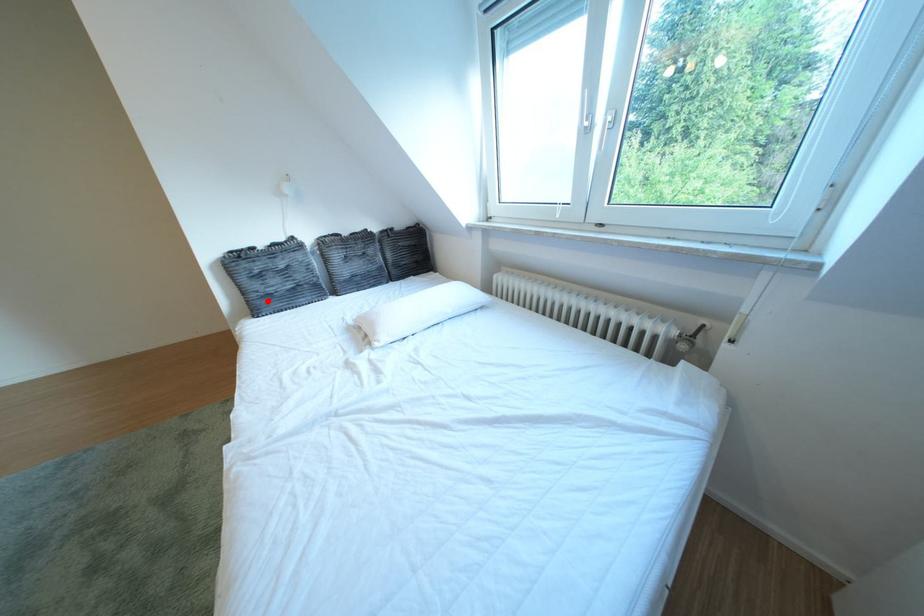
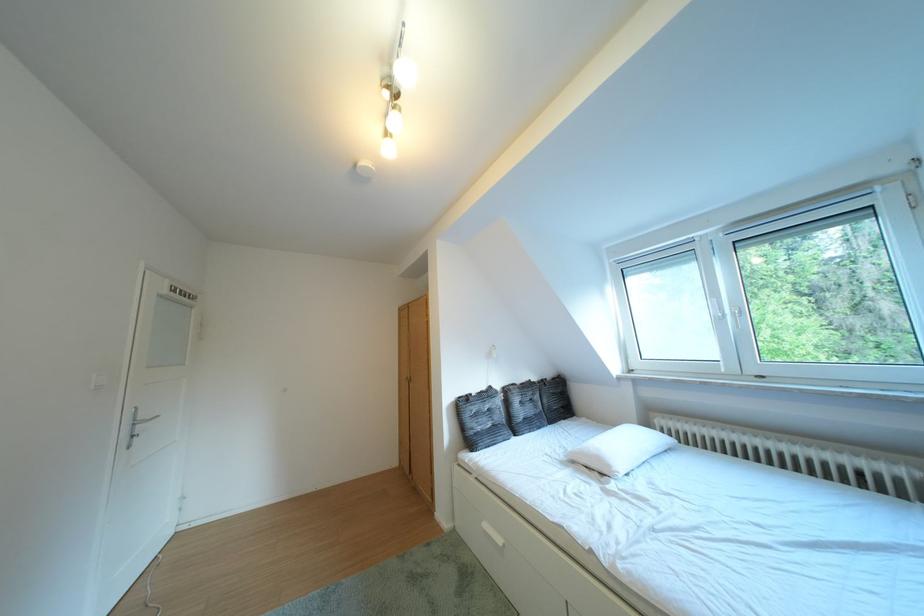
Question: I am providing you with two images of the same scene from different viewpoints. Given a red point in image1, look at the same physical point in image2. Is it:

Choices:
 (A) Closer to the viewpoint
 (B) Farther from the viewpoint

Answer: (B)